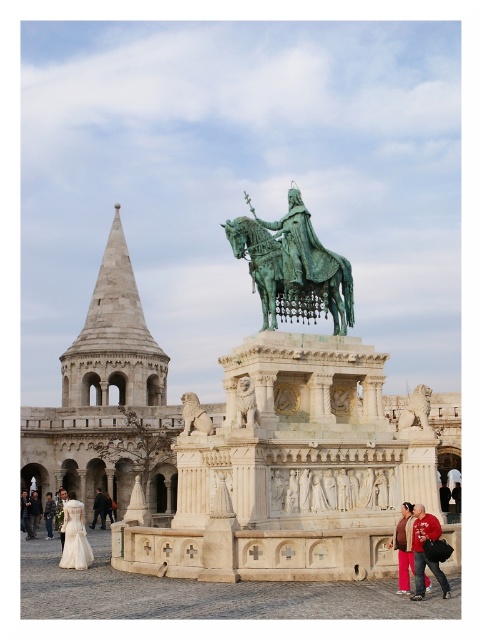
Measure the distance from green patinated metal horse at center to polished stone lion at center.

green patinated metal horse at center and polished stone lion at center are 27.23 feet apart.

Does green patinated metal horse at center have a greater width compared to polished stone lion at center?

Yes, green patinated metal horse at center is wider than polished stone lion at center.

Is point (338, 323) farther from viewer compared to point (186, 419)?

Yes, it is behind point (186, 419).

Where is `green patinated metal horse at center`? This screenshot has width=482, height=640. green patinated metal horse at center is located at coordinates (291, 280).

Is white stone tower at upper left smaller than polished stone lion at center?

No, white stone tower at upper left is not smaller than polished stone lion at center.

Which is more to the left, white stone tower at upper left or polished stone lion at center?

Positioned to the left is white stone tower at upper left.

What do you see at coordinates (115, 339) in the screenshot? I see `white stone tower at upper left` at bounding box center [115, 339].

Where is `white stone tower at upper left`? The image size is (482, 640). white stone tower at upper left is located at coordinates (115, 339).

Which is above, green patinated metal horse at center or green stone lion at center?

green patinated metal horse at center is above.

Between green patinated metal horse at center and green stone lion at center, which one has more height?

Standing taller between the two is green stone lion at center.

At what (x,y) coordinates should I click in order to perform the action: click on green patinated metal horse at center. Please return your answer as a coordinate pair (x, y). Looking at the image, I should click on (291, 280).